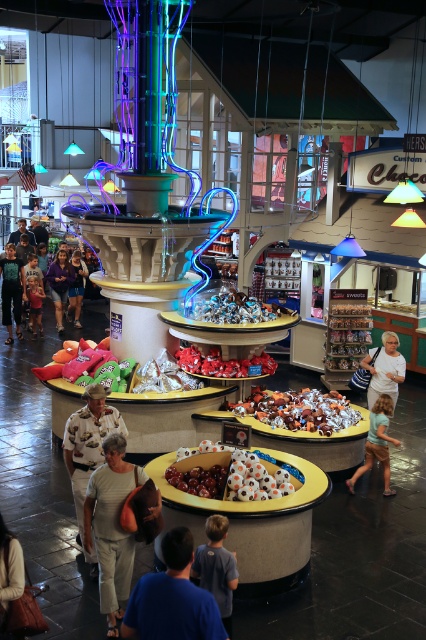
Question: Which of these objects is positioned farthest from the blue cotton shirt at lower center?

Choices:
 (A) light blue denim shorts at lower right
 (B) dark blue t-shirt at lower center

Answer: (A)

Question: Which point is closer to the camera?

Choices:
 (A) camouflage shirt at center
 (B) matte blue shirt at center
 (C) light brown leather jacket at lower left

Answer: (A)

Question: Can you confirm if camouflage shirt at center is positioned to the left of matte blue shirt at center?

Choices:
 (A) yes
 (B) no

Answer: (B)

Question: Which point is farther from the camera taking this photo?

Choices:
 (A) (400, 442)
 (B) (60, 282)

Answer: (B)

Question: Considering the relative positions of white cotton shirt at right and light blue denim shorts at lower right in the image provided, where is white cotton shirt at right located with respect to light blue denim shorts at lower right?

Choices:
 (A) left
 (B) right

Answer: (B)

Question: Does light blue denim shorts at lower right have a lesser width compared to matte blue shirt at center?

Choices:
 (A) yes
 (B) no

Answer: (B)